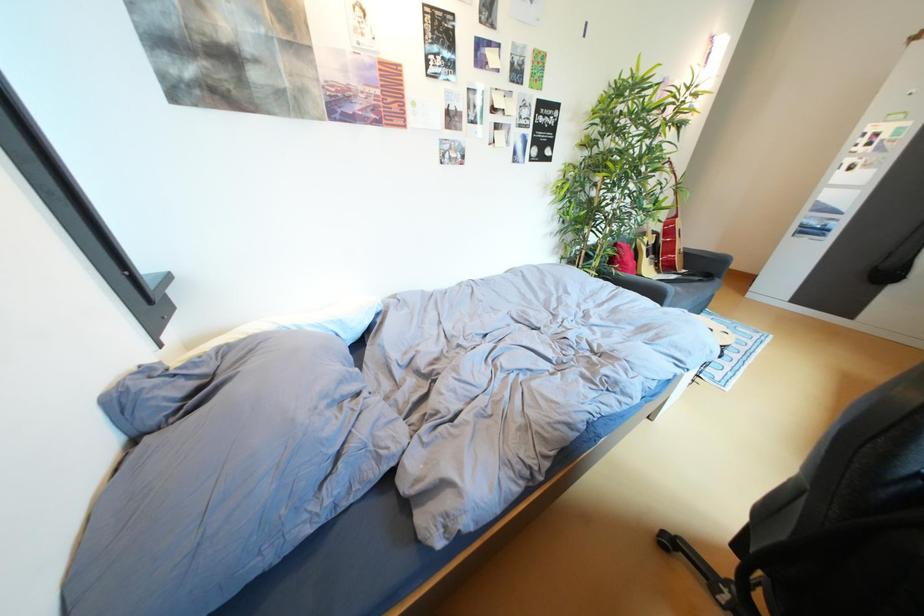
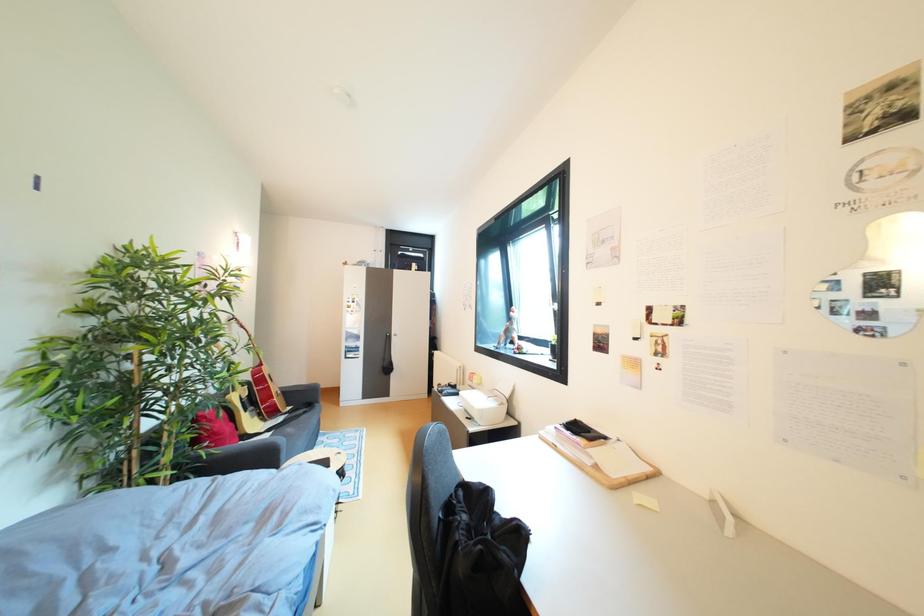
Question: How did the camera likely rotate?

Choices:
 (A) Left
 (B) Right
 (C) Up
 (D) Down

Answer: (B)